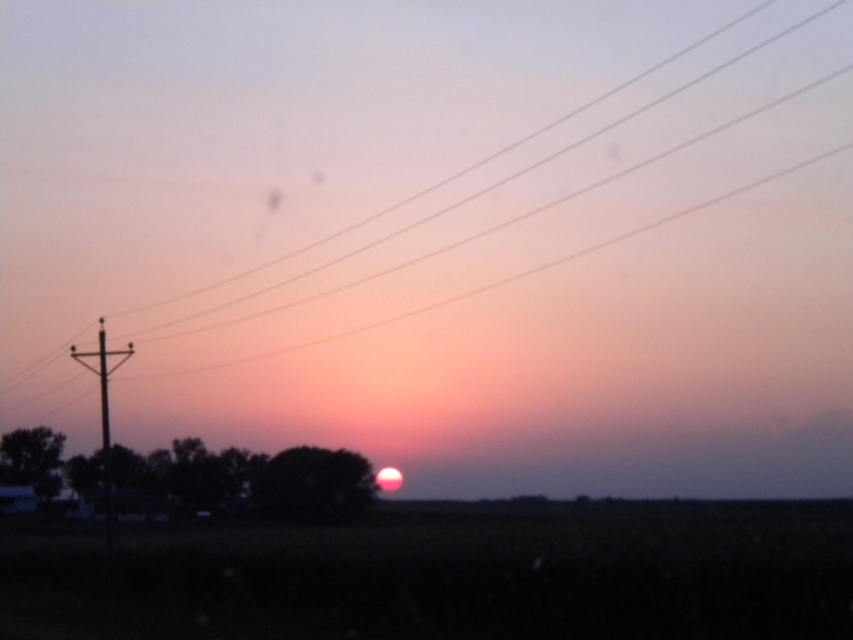
Between point (13, 440) and point (219, 285), which one is positioned in front?

Point (13, 440) is more forward.

Is green matte tree at lower center positioned in front of metallic wires at upper center?

Yes, it is.

Who is more forward, [223,477] or [541,157]?

Point [223,477]

The image size is (853, 640). What are the coordinates of `green matte tree at lower center` in the screenshot? It's located at (251, 480).

Does silhouette tree at center have a smaller size compared to green matte tree at lower left?

Yes, silhouette tree at center is smaller than green matte tree at lower left.

Is silhouette tree at center wider than green matte tree at lower left?

Incorrect, silhouette tree at center's width does not surpass green matte tree at lower left's.

Measure the distance between silhouette tree at center and camera.

silhouette tree at center is 300.32 feet away from camera.

Where is `silhouette tree at center`? silhouette tree at center is located at coordinates (314, 484).

Does metallic wires at upper center have a smaller size compared to smooth wood telegraph pole at left?

No, metallic wires at upper center is not smaller than smooth wood telegraph pole at left.

Does metallic wires at upper center lie behind smooth wood telegraph pole at left?

That is True.

Is point (608, 180) positioned after point (100, 388)?

Yes, it is.

At what (x,y) coordinates should I click in order to perform the action: click on metallic wires at upper center. Please return your answer as a coordinate pair (x, y). Image resolution: width=853 pixels, height=640 pixels. Looking at the image, I should click on (450, 173).